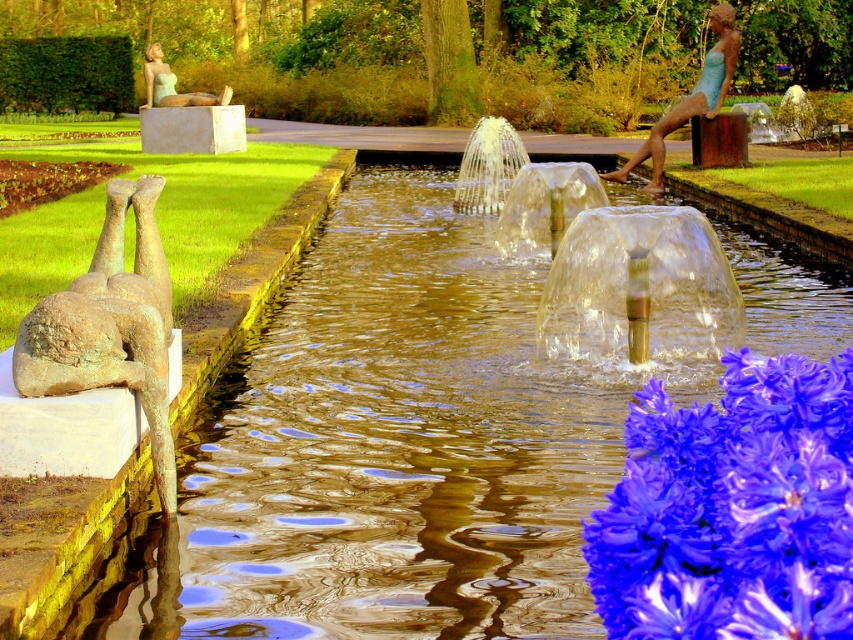
Looking at this image, what are the coordinates of the bronze statue at left in the image?

The bronze statue at left is located at coordinates point (109, 324).

You are standing at the center of the garden facing the water feature. Which direction should you turn to find the bronze statue at left?

Since the bronze statue at left is located at the left side of the water feature, you should turn to your left to find it.